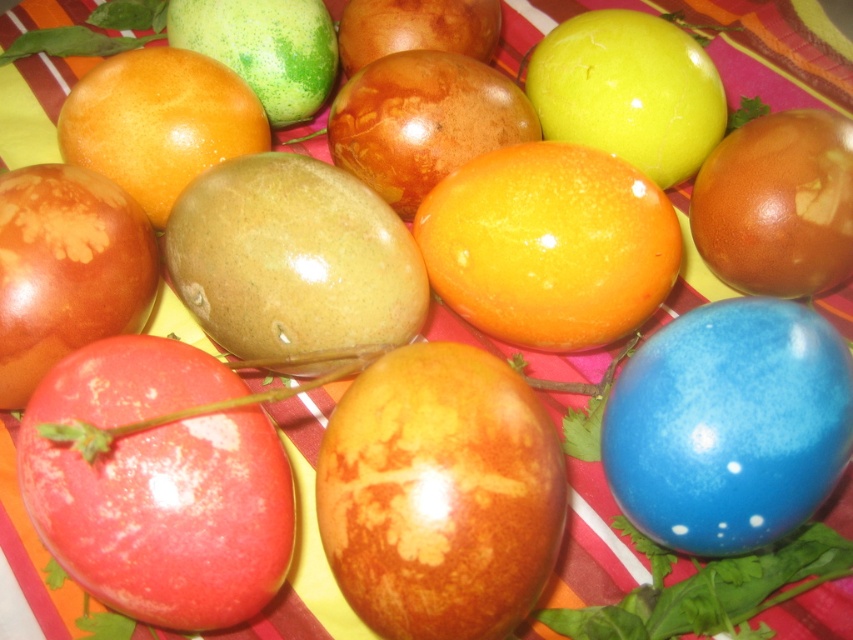
Question: Does brown marbled egg at center appear under blue glossy egg at lower right?

Choices:
 (A) yes
 (B) no

Answer: (A)

Question: Is brown marbled egg at center smaller than blue glossy egg at lower right?

Choices:
 (A) yes
 (B) no

Answer: (A)

Question: Which object appears farthest from the camera in this image?

Choices:
 (A) blue glossy egg at lower right
 (B) brown marbled egg at center

Answer: (A)

Question: In this image, where is brown marbled egg at center located relative to blue glossy egg at lower right?

Choices:
 (A) below
 (B) above

Answer: (A)

Question: Which of the following is the farthest from the observer?

Choices:
 (A) (785, 532)
 (B) (352, 593)

Answer: (A)